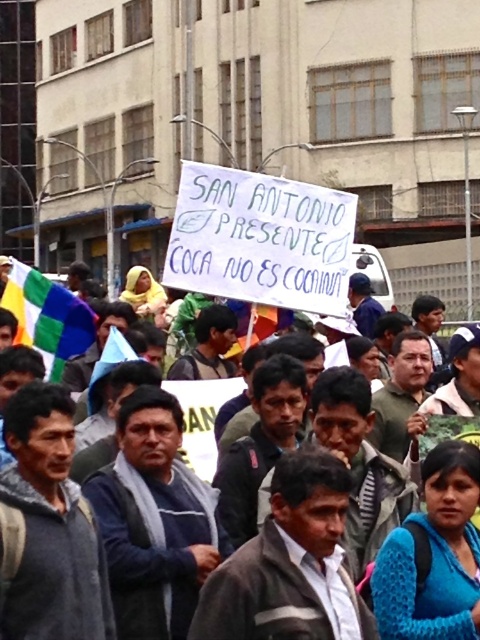
Is white paper sign at center taller than multicolored fabric flag at left?

Yes, white paper sign at center is taller than multicolored fabric flag at left.

Between white paper sign at center and multicolored fabric flag at left, which one appears on the right side from the viewer's perspective?

white paper sign at center is more to the right.

Is point (352, 532) closer to viewer compared to point (52, 301)?

Yes.

I want to click on white paper sign at center, so click(x=421, y=388).